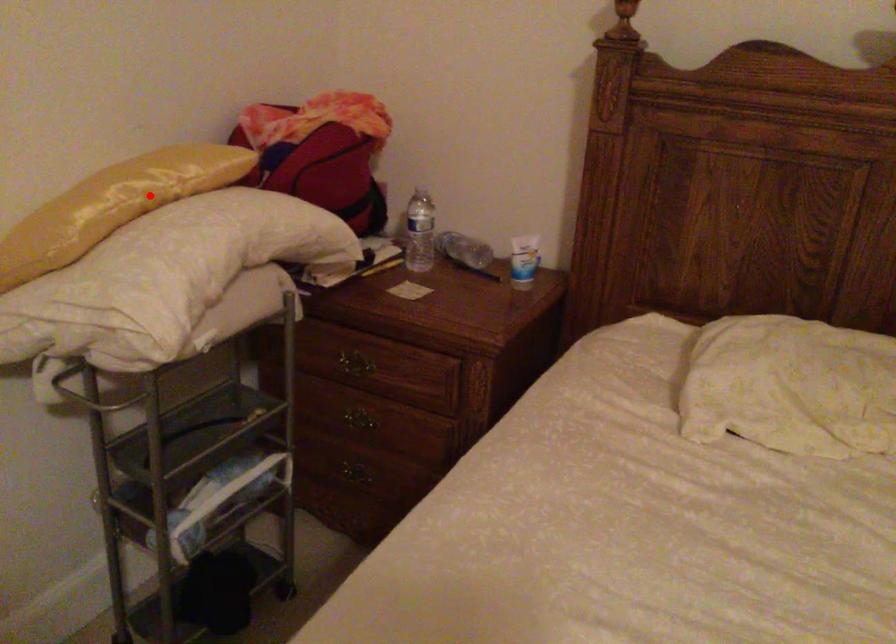
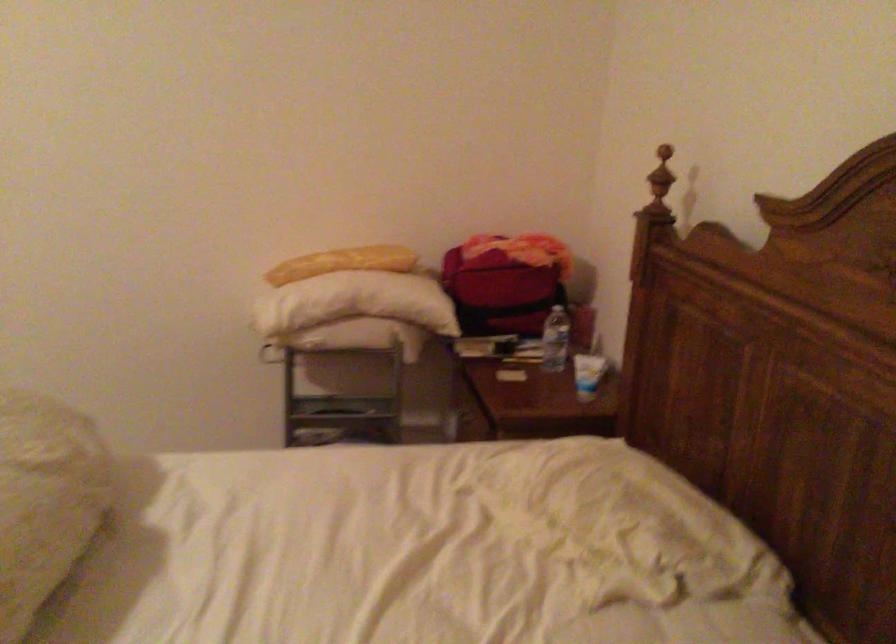
The point at the highlighted location is marked in the first image. Where is the corresponding point in the second image?

(342, 263)